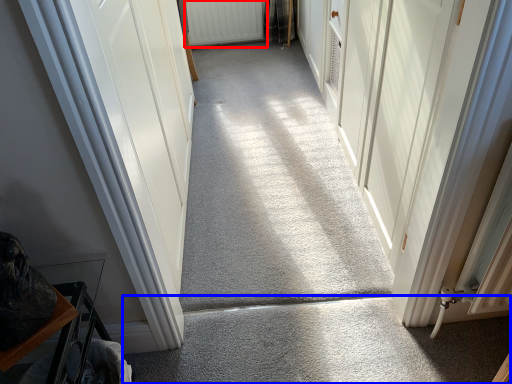
Question: Which object appears farthest to the camera in this image, radiator (highlighted by a red box) or concrete (highlighted by a blue box)?

Choices:
 (A) radiator
 (B) concrete

Answer: (A)